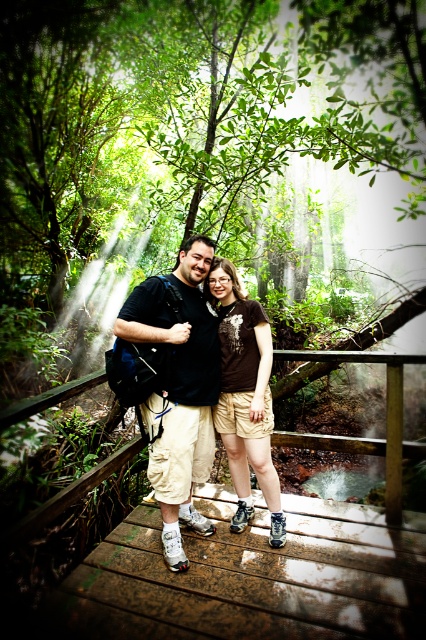
Can you confirm if brown wooden bridge at center is wider than matte black t-shirt at center?

Correct, the width of brown wooden bridge at center exceeds that of matte black t-shirt at center.

Is the position of brown wooden bridge at center less distant than that of matte black t-shirt at center?

Yes, brown wooden bridge at center is in front of matte black t-shirt at center.

Between point (370, 536) and point (203, 380), which one is positioned in front?

Point (203, 380)

You are a GUI agent. You are given a task and a screenshot of the screen. Output one action in this format:
    pyautogui.click(x=<x>, y=<y>)
    Task: Click on the brown wooden bridge at center
    Image resolution: width=426 pixels, height=640 pixels.
    Given the screenshot: What is the action you would take?
    pyautogui.click(x=278, y=557)

What do you see at coordinates (178, 387) in the screenshot?
I see `matte black t-shirt at center` at bounding box center [178, 387].

Which is behind, point (181, 376) or point (233, 307)?

Positioned behind is point (233, 307).

From the picture: Who is more forward, (175, 448) or (224, 385)?

Point (175, 448) is more forward.

Locate an element on the screen. matte black t-shirt at center is located at coordinates (178, 387).

Is brown wooden bridge at center below brown fabric shorts at center?

Indeed, brown wooden bridge at center is positioned under brown fabric shorts at center.

Who is more distant from viewer, (x=423, y=362) or (x=262, y=433)?

The point (x=423, y=362) is behind.

Which is behind, point (77, 609) or point (229, 454)?

Point (229, 454)

Locate an element on the screen. Image resolution: width=426 pixels, height=640 pixels. brown wooden bridge at center is located at coordinates (278, 557).